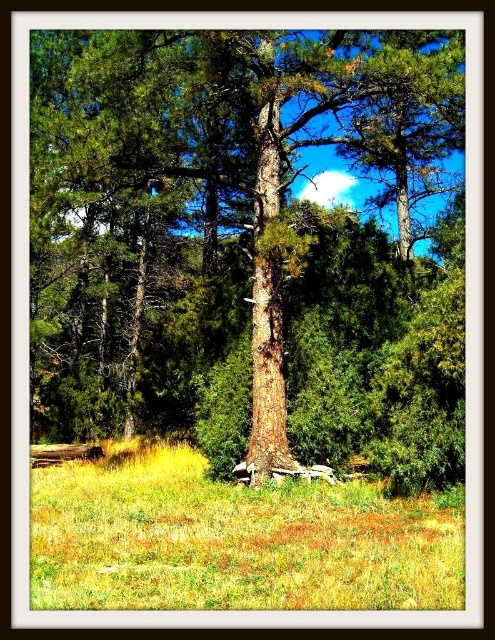
The width and height of the screenshot is (495, 640). What are the coordinates of `brown rough bark tree at center` in the screenshot? It's located at (246, 246).

Is point (224, 420) positioned before point (127, 561)?

No, (224, 420) is behind (127, 561).

At what (x,y) coordinates should I click in order to perform the action: click on brown rough bark tree at center. Please return your answer as a coordinate pair (x, y). This screenshot has height=640, width=495. Looking at the image, I should click on (246, 246).